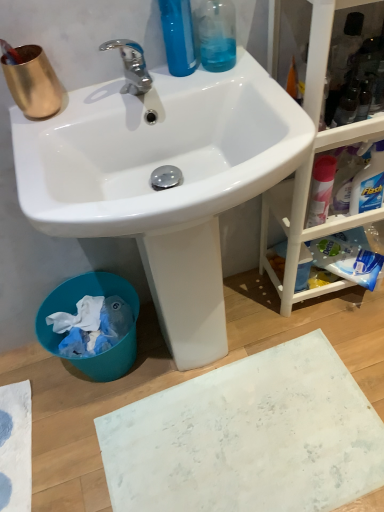
You are a GUI agent. You are given a task and a screenshot of the screen. Output one action in this format:
    pyautogui.click(x=<x>, y=<y>)
    Task: Click on the vacant space to the left of chrome metallic faucet at upper center
    This screenshot has height=512, width=384.
    Given the screenshot: What is the action you would take?
    pyautogui.click(x=78, y=110)